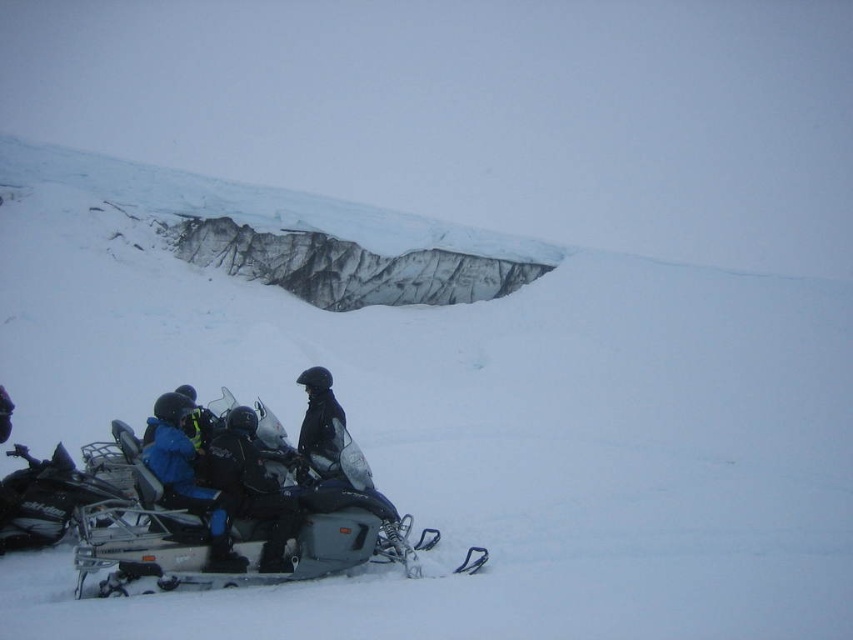
Question: Which object is closer to the camera taking this photo?

Choices:
 (A) black matte snowmobile at lower left
 (B) metallic silver snowmobile at lower center
 (C) black matte jacket at center

Answer: (B)

Question: Among these objects, which one is farthest from the camera?

Choices:
 (A) black matte snowmobile at lower left
 (B) metallic silver snowmobile at lower center

Answer: (A)

Question: Which object is positioned closest to the black matte snowmobile at lower left?

Choices:
 (A) black matte jacket at center
 (B) blue fabric jacket at lower left
 (C) metallic silver snowmobile at lower left
 (D) metallic silver snowmobile at lower center

Answer: (B)

Question: Is metallic silver snowmobile at lower center above blue fabric jacket at lower left?

Choices:
 (A) yes
 (B) no

Answer: (B)

Question: Is metallic silver snowmobile at lower center positioned in front of black matte jacket at center?

Choices:
 (A) no
 (B) yes

Answer: (B)

Question: Can you confirm if metallic silver snowmobile at lower left is wider than blue fabric jacket at lower left?

Choices:
 (A) yes
 (B) no

Answer: (B)